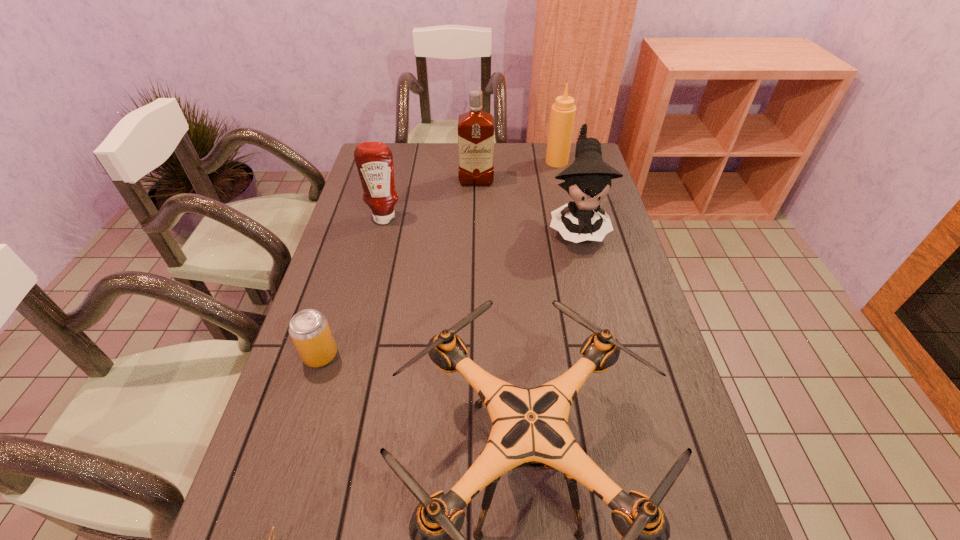
In order to click on liquor in this screenshot , I will do `click(475, 128)`.

This screenshot has height=540, width=960. I want to click on the farther condiment, so click(x=563, y=111).

Identify the location of the right condiment. (563, 111).

This screenshot has height=540, width=960. Identify the location of doll. (588, 180).

Locate an element on the screen. This screenshot has height=540, width=960. the left condiment is located at coordinates (374, 160).

Locate an element on the screen. The width and height of the screenshot is (960, 540). the sixth tallest object is located at coordinates (309, 329).

Where is `free space located 0.320m on the front label of the sixth nearest object`? This screenshot has width=960, height=540. free space located 0.320m on the front label of the sixth nearest object is located at coordinates (475, 247).

Identify the location of vacant space located on the left of the farthest object. (462, 162).

Identify the location of vacant space located at the face of the doll. (607, 348).

I want to click on free spot located 0.250m on the back of the nearer condiment, so click(396, 170).